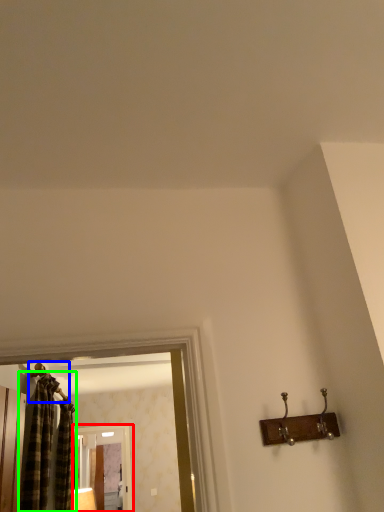
Question: Which object is the farthest from screen door (highlighted by a red box)? Choose among these: hanger (highlighted by a blue box) or curtain (highlighted by a green box).

Choices:
 (A) hanger
 (B) curtain

Answer: (A)